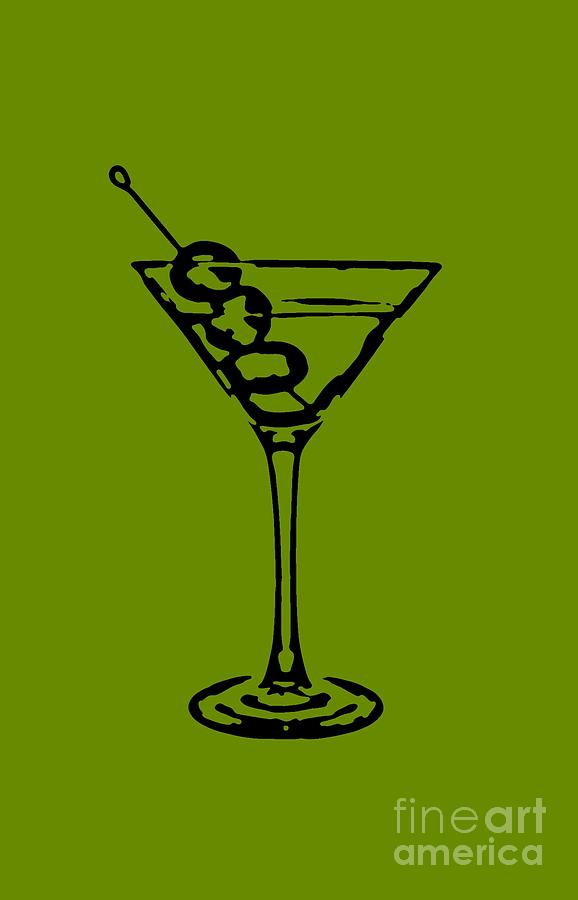
Identify the location of rim of glass. The width and height of the screenshot is (578, 900). (377, 266).